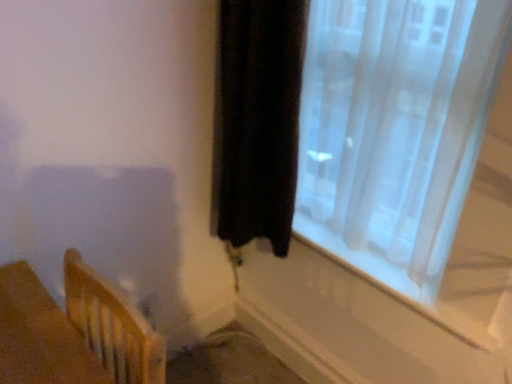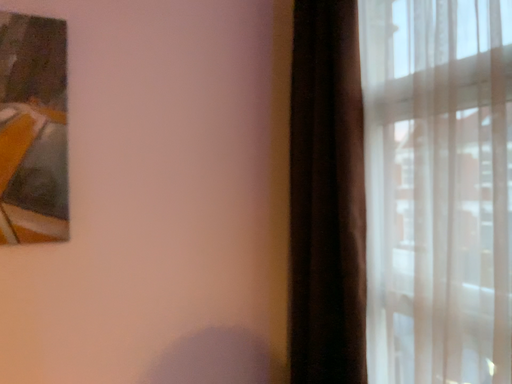
Question: How did the camera likely rotate when shooting the video?

Choices:
 (A) rotated left
 (B) rotated right

Answer: (A)